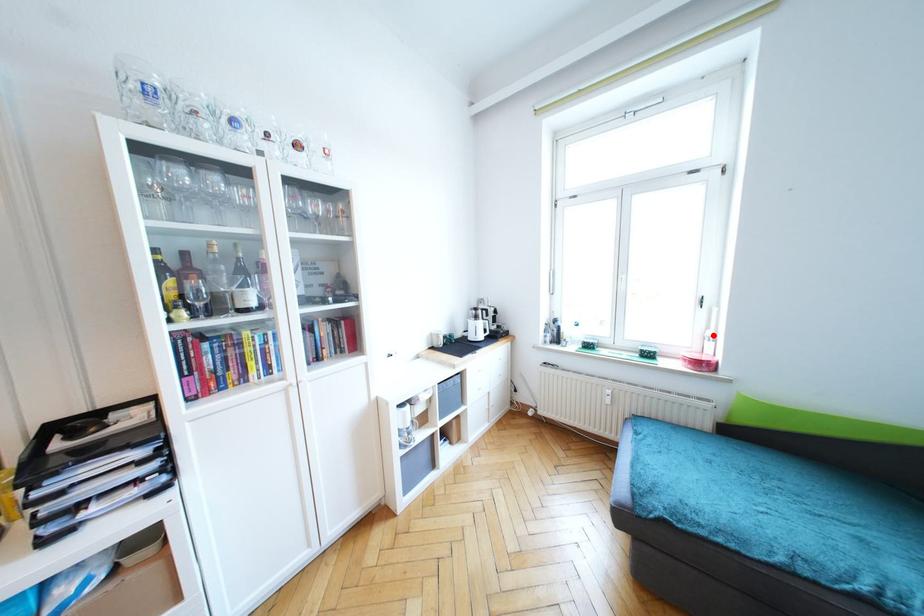
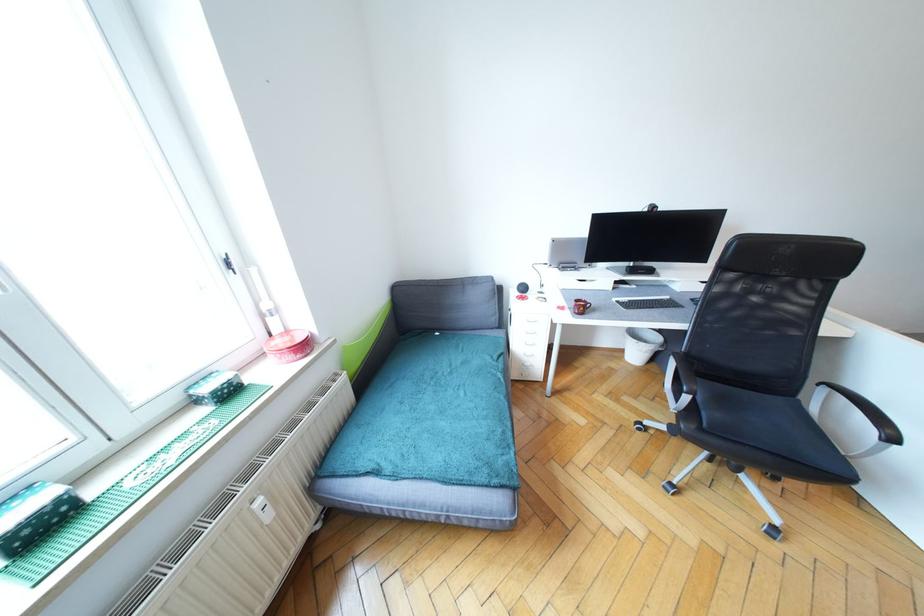
Question: I am providing you with two images of the same scene from different viewpoints. Image1 has a red point marked. In image2, the corresponding 3D location appears at what relative position? Reply with the corresponding letter.

Choices:
 (A) Closer
 (B) Farther

Answer: (A)